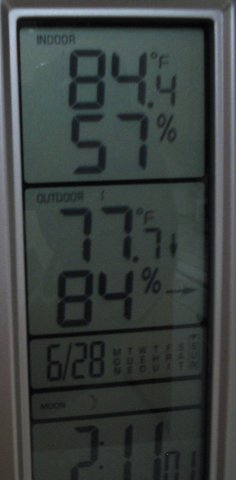
The width and height of the screenshot is (236, 480). Identify the location of different screens. pos(188,102), pos(188,435), pos(187,388), pos(184,328), pos(179,277).